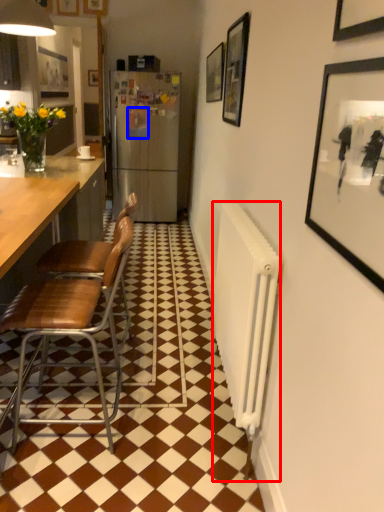
Question: Which of the following is the farthest to the observer, radiator (highlighted by a red box) or picture frame (highlighted by a blue box)?

Choices:
 (A) radiator
 (B) picture frame

Answer: (B)